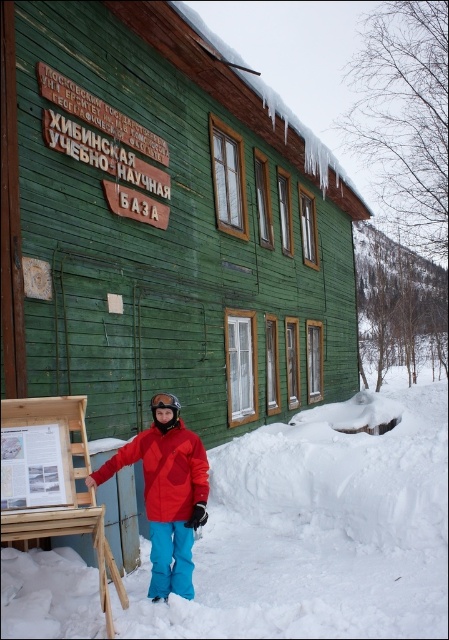
Is red matte jacket at center positioned before black matte goggles at center?

Yes, it is.

Can you confirm if red matte jacket at center is thinner than black matte goggles at center?

Incorrect, red matte jacket at center's width is not less than black matte goggles at center's.

Measure the distance between point (193,480) and camera.

4.90 meters

The height and width of the screenshot is (640, 449). I want to click on red matte jacket at center, so click(x=166, y=472).

Is the position of white fluffy snow at lower center less distant than that of red matte jacket at center?

Yes, it is.

Is white fluffy snow at lower center smaller than red matte jacket at center?

No.

Is point (286, 564) more distant than point (161, 515)?

Yes, it is.

The width and height of the screenshot is (449, 640). I want to click on white fluffy snow at lower center, so click(318, 531).

Who is shorter, white fluffy snow at lower center or black matte goggles at center?

Standing shorter between the two is black matte goggles at center.

Is point (427, 419) behind point (176, 401)?

Yes, point (427, 419) is farther from viewer.

The width and height of the screenshot is (449, 640). Find the location of `white fluffy snow at lower center`. white fluffy snow at lower center is located at coordinates (318, 531).